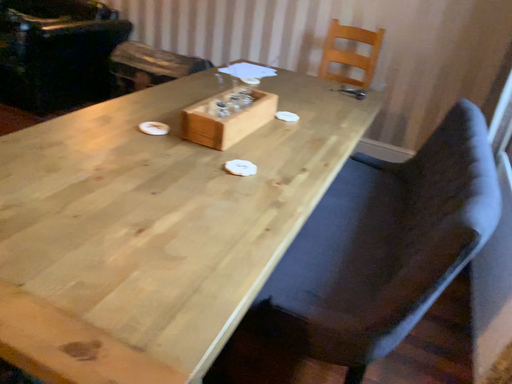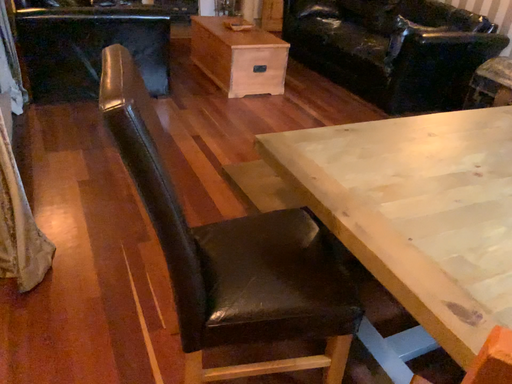
Question: Which way did the camera rotate in the video?

Choices:
 (A) rotated right
 (B) rotated left

Answer: (B)